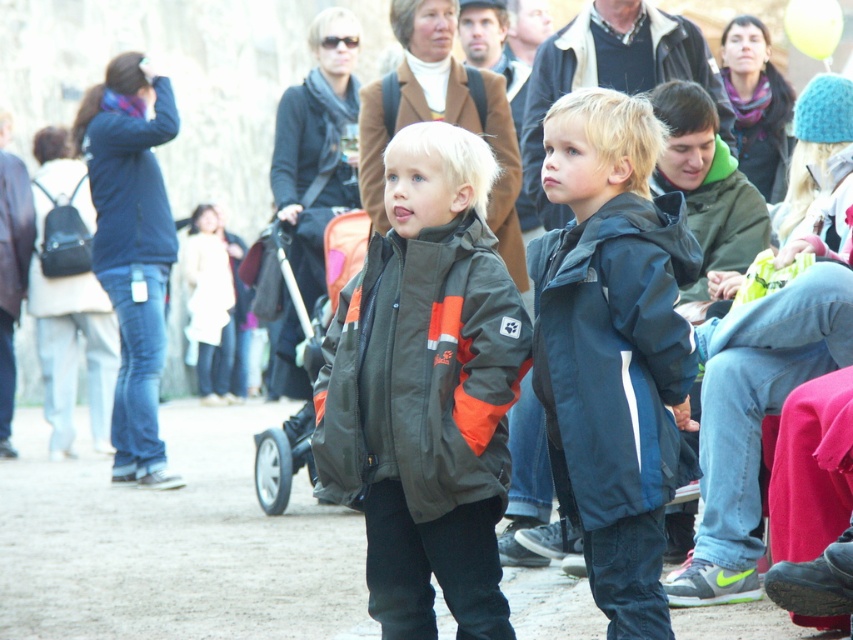
Between dark blue waterproof jacket at center and dark blue nylon jacket at center, which one is positioned lower?

Positioned lower is dark blue waterproof jacket at center.

Can you confirm if dark blue waterproof jacket at center is positioned above dark blue nylon jacket at center?

No.

Locate an element on the screen. This screenshot has height=640, width=853. dark blue waterproof jacket at center is located at coordinates pyautogui.click(x=614, y=355).

Which is below, dark gray fleece jacket at center or dark blue waterproof jacket at center?

dark blue waterproof jacket at center is lower down.

I want to click on dark gray fleece jacket at center, so click(424, 372).

Does dark gray fleece jacket at center appear on the right side of green fleece jacket at upper right?

No, dark gray fleece jacket at center is not to the right of green fleece jacket at upper right.

Between dark gray fleece jacket at center and green fleece jacket at upper right, which one is positioned higher?

dark gray fleece jacket at center is higher up.

Where is `dark gray fleece jacket at center`? The width and height of the screenshot is (853, 640). dark gray fleece jacket at center is located at coordinates (424, 372).